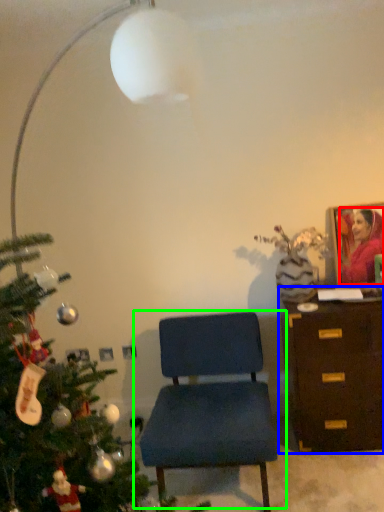
Question: Which object is positioned farthest from person (highlighted by a red box)? Select from chest of drawers (highlighted by a blue box) and chair (highlighted by a green box).

Choices:
 (A) chest of drawers
 (B) chair

Answer: (B)